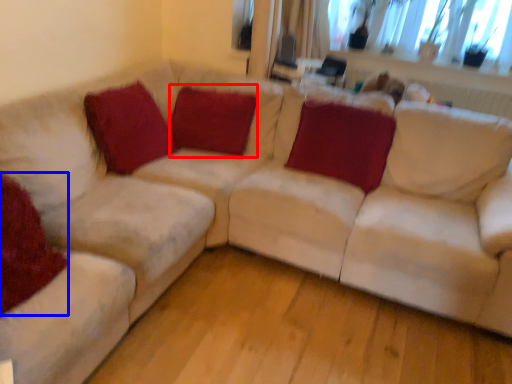
Question: Which point is closer to the camera, pillow (highlighted by a red box) or pillow (highlighted by a blue box)?

Choices:
 (A) pillow
 (B) pillow

Answer: (B)